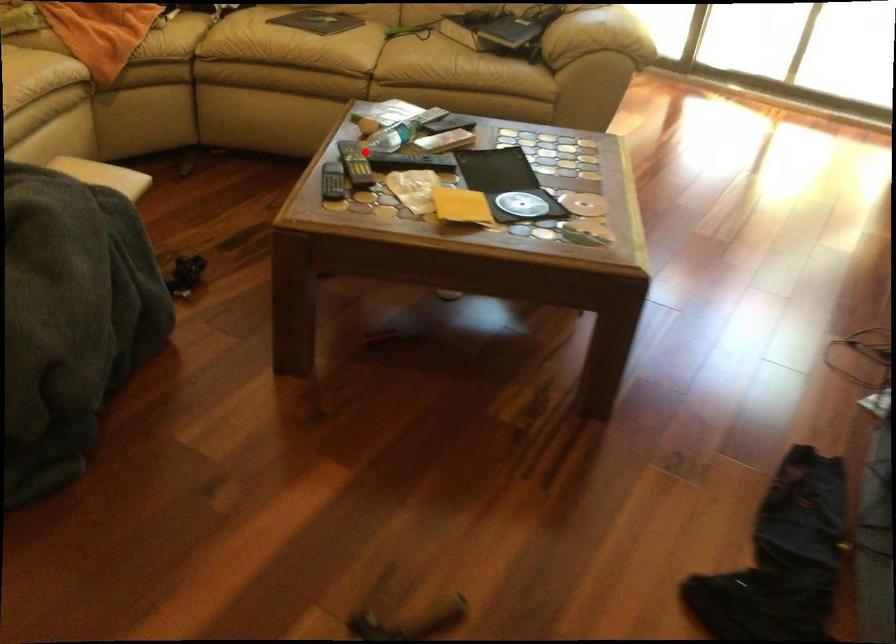
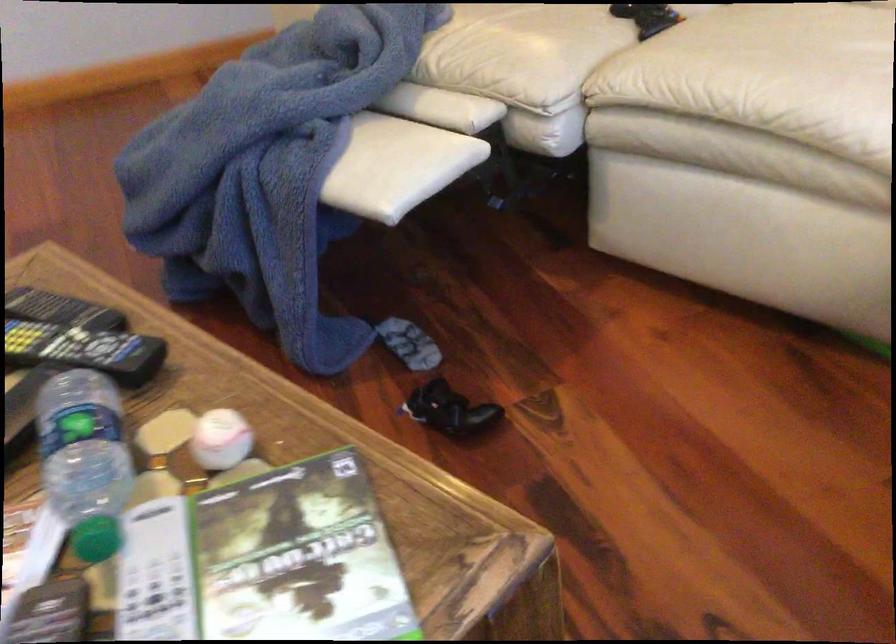
The point at the highlighted location is marked in the first image. Where is the corresponding point in the second image?

(84, 350)